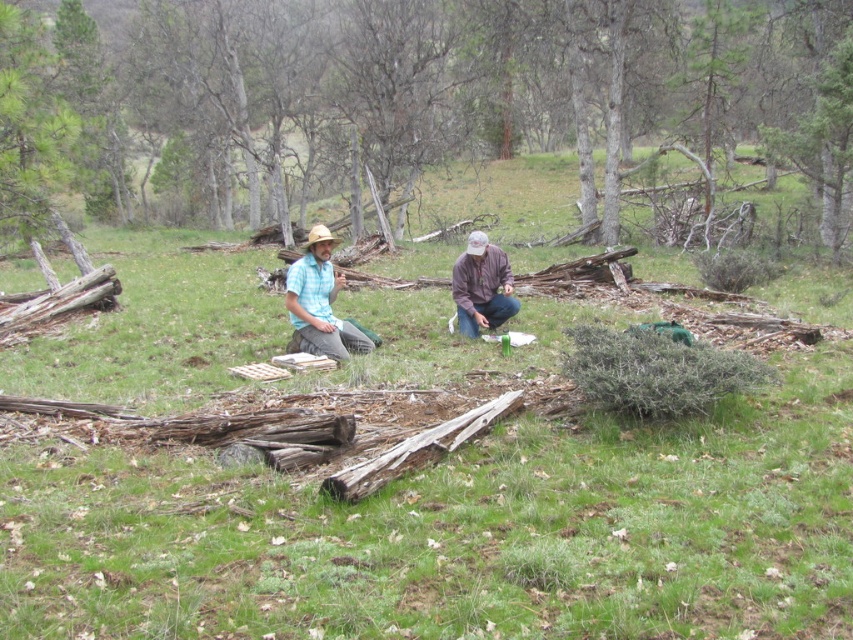
Question: Can you confirm if light blue plaid shirt at center is wider than brown leather jacket at center?

Choices:
 (A) yes
 (B) no

Answer: (A)

Question: Observing the image, what is the correct spatial positioning of light blue cotton shirt at center in reference to light blue plaid shirt at center?

Choices:
 (A) below
 (B) above

Answer: (B)

Question: Which of the following is the closest to the observer?

Choices:
 (A) (263, 116)
 (B) (308, 240)

Answer: (B)

Question: Can you confirm if smooth bark tree at center is smaller than light blue cotton shirt at center?

Choices:
 (A) no
 (B) yes

Answer: (A)

Question: Which point is closer to the camera taking this photo?

Choices:
 (A) (494, 291)
 (B) (534, 29)
 (C) (485, 317)

Answer: (C)

Question: Which point is farther to the camera?

Choices:
 (A) (306, 337)
 (B) (474, 241)

Answer: (B)